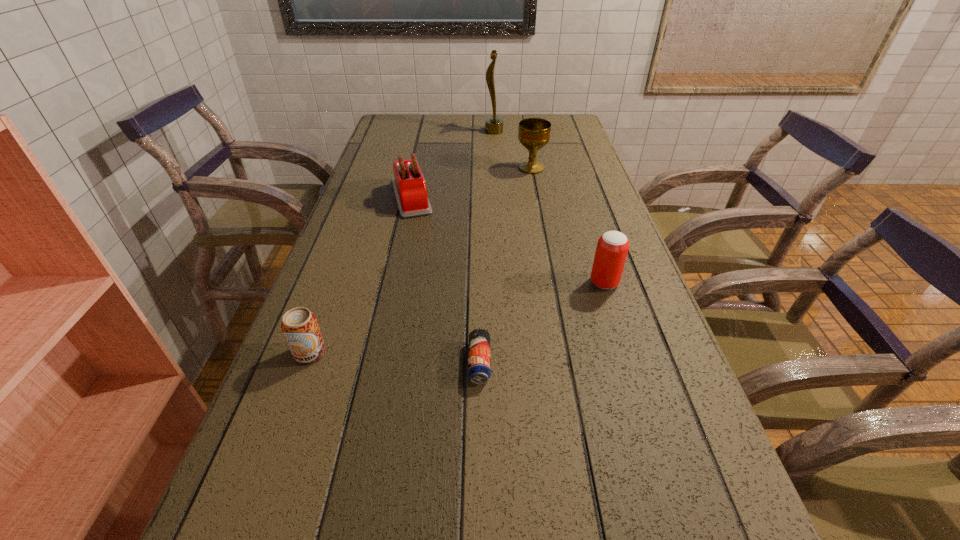
The height and width of the screenshot is (540, 960). Find the location of `the shortest beer can`. the shortest beer can is located at coordinates (479, 357).

This screenshot has width=960, height=540. Find the location of `the shortest object`. the shortest object is located at coordinates (479, 357).

The width and height of the screenshot is (960, 540). Identify the location of free space located 0.080m on the front-facing side of the award. (464, 131).

This screenshot has width=960, height=540. Identify the location of blank space located on the front-facing side of the award. (391, 131).

Locate an element on the screen. free location located on the front-facing side of the award is located at coordinates (453, 131).

Identify the location of vacant space located on the right of the fifth object from left to right. (574, 168).

I want to click on vacant space situated on the left of the toaster, so click(372, 197).

Locate an element on the screen. This screenshot has height=540, width=960. vacant space located on the front of the tallest beer can is located at coordinates (625, 347).

Locate an element on the screen. The width and height of the screenshot is (960, 540). vacant space located on the front of the fifth tallest object is located at coordinates (296, 392).

Locate an element on the screen. This screenshot has width=960, height=540. free space located 0.140m on the right of the shortest object is located at coordinates (563, 362).